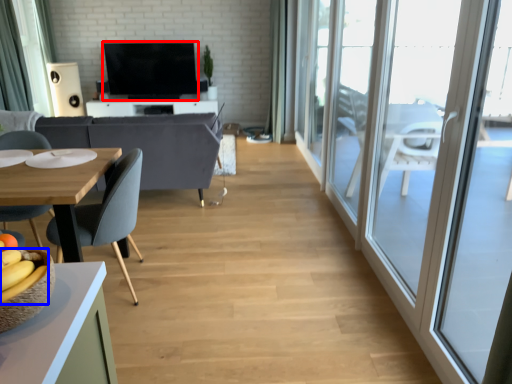
Question: Which of the following is the farthest to the observer, television (highlighted by a red box) or banana (highlighted by a blue box)?

Choices:
 (A) television
 (B) banana

Answer: (A)